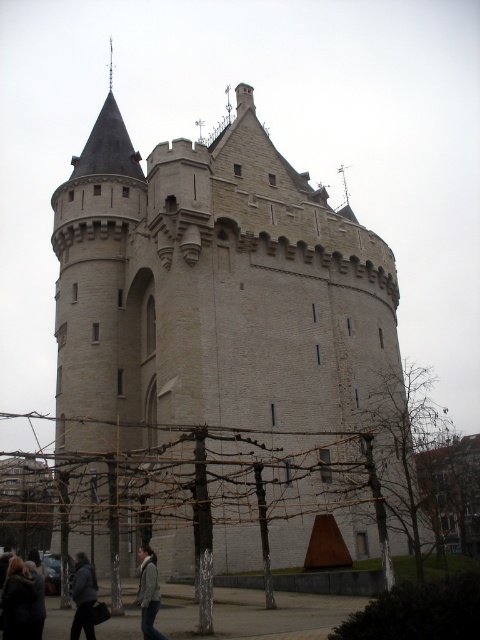
You are a painter standing at the base of the beige stone castle at center and want to paint the dark brown leather jacket at lower left. Since you can only carry a limited amount of paint, which object requires more paint to cover its width?

The beige stone castle at center requires more paint to cover its width because its width is larger than the dark brown leather jacket at lower left.

You are an artist planning to paint the beige stone castle at center and the dark brown leather jacket at lower left. Since you want to emphasize the size difference between them, which object should you paint larger on your canvas?

The beige stone castle at center should be painted larger because it is bigger than the dark brown leather jacket at lower left according to the description.

You are a tourist visiting the historic stone tower. You notice the beige stone castle at center and the khaki fabric jacket at lower center. Which object is wider?

The beige stone castle at center is wider than the khaki fabric jacket at lower center.